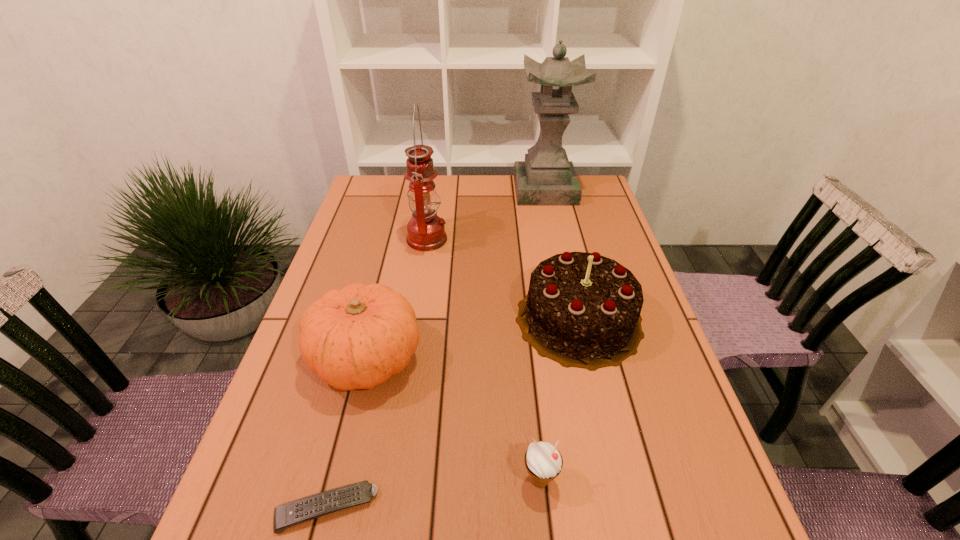
I want to click on vacant region located 0.260m on the front of the birthday cake, so click(x=619, y=494).

You are a GUI agent. You are given a task and a screenshot of the screen. Output one action in this format:
    pyautogui.click(x=<x>, y=<y>)
    Task: Click on the vacant position located 0.130m on the back of the pumpkin
    
    Given the screenshot: What is the action you would take?
    pyautogui.click(x=385, y=283)

At what (x,y) coordinates should I click in order to perform the action: click on vacant space located on the right of the second shortest object. Please return your answer as a coordinate pair (x, y). The width and height of the screenshot is (960, 540). Looking at the image, I should click on (592, 480).

The height and width of the screenshot is (540, 960). Identify the location of vacant area situated 0.260m on the right of the shortest object. (530, 508).

Where is `object that is positioned at the far edge`? The image size is (960, 540). object that is positioned at the far edge is located at coordinates (546, 178).

Locate an element on the screen. pumpkin at the left edge is located at coordinates (356, 338).

Identify the location of remote control situated at the left edge. The image size is (960, 540). [308, 508].

At what (x,y) coordinates should I click in order to perform the action: click on sculpture at the right edge. Please return your answer as a coordinate pair (x, y). The height and width of the screenshot is (540, 960). Looking at the image, I should click on click(546, 178).

This screenshot has height=540, width=960. Identify the location of birthday cake positioned at the right edge. (582, 310).

Find the location of `object positioned at the far right corner`. object positioned at the far right corner is located at coordinates (546, 178).